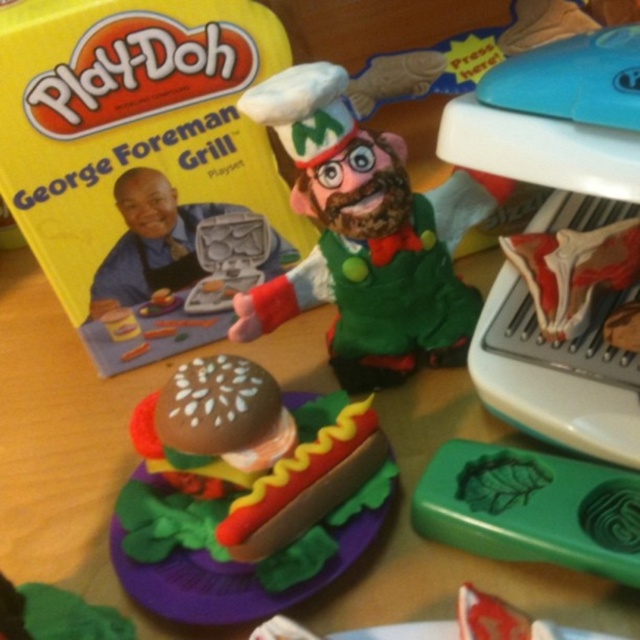
You are a customer in a toy store looking at the Play Doh George Foreman Grill playset. You see the green felt chef at center and the green matte leaf at lower right. Which object is closer to you?

The green felt chef at center is closer to you because the green matte leaf at lower right is behind it.

Based on the photo, where is the matte plastic hot dog at center located in the image?

The matte plastic hot dog at center is located at point (243, 493).

You are a child trying to decide which object to pick up first. The green felt chef at center and the green matte leaf at lower right are both in your view. Which one do you think is taller?

The green felt chef at center is taller than the green matte leaf at lower right.